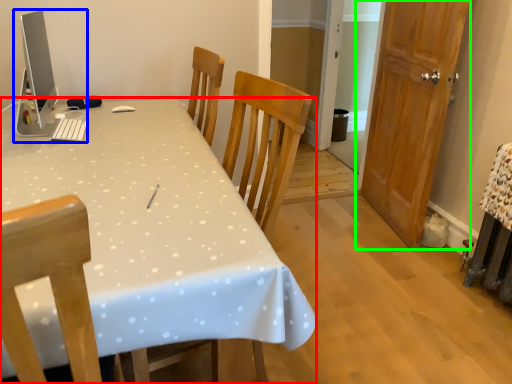
Question: Which is nearer to the desk (highlighted by a red box)? desktop computer (highlighted by a blue box) or door (highlighted by a green box).

Choices:
 (A) desktop computer
 (B) door

Answer: (A)